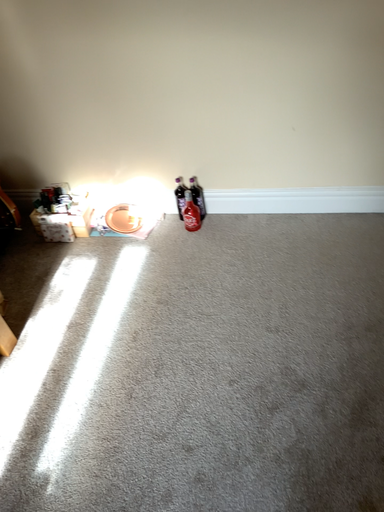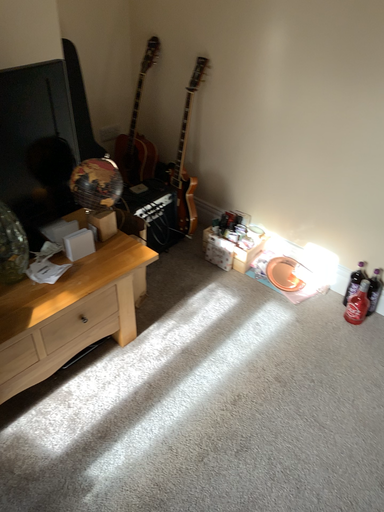
Question: How did the camera likely rotate when shooting the video?

Choices:
 (A) rotated upward
 (B) rotated downward

Answer: (A)